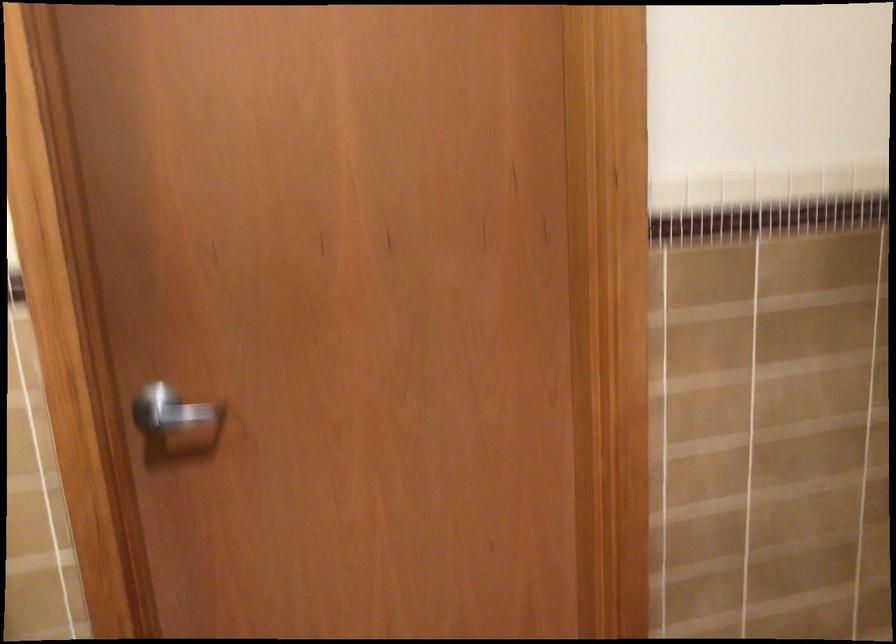
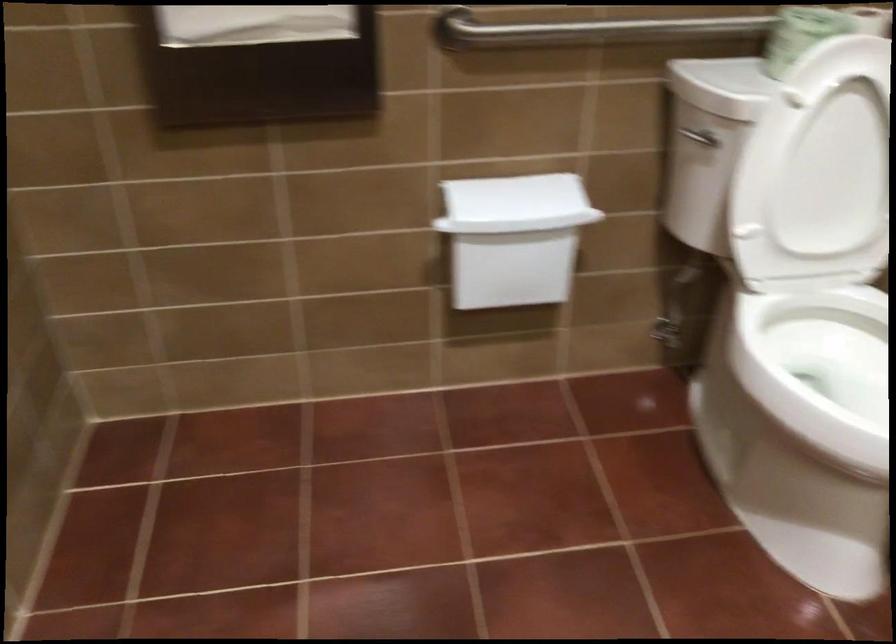
The first image is from the beginning of the video and the second image is from the end. How did the camera likely rotate when shooting the video?

The camera's rotation is toward right-down.